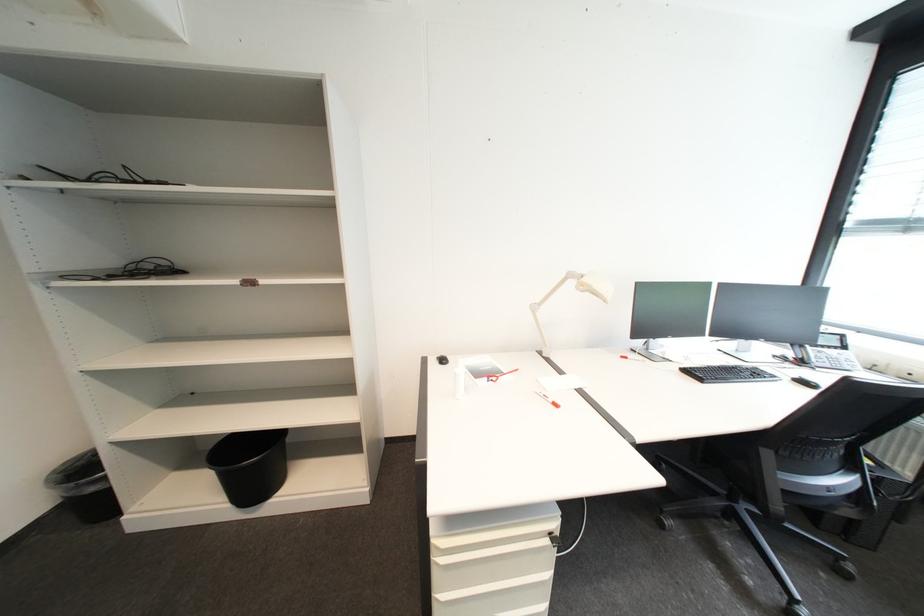
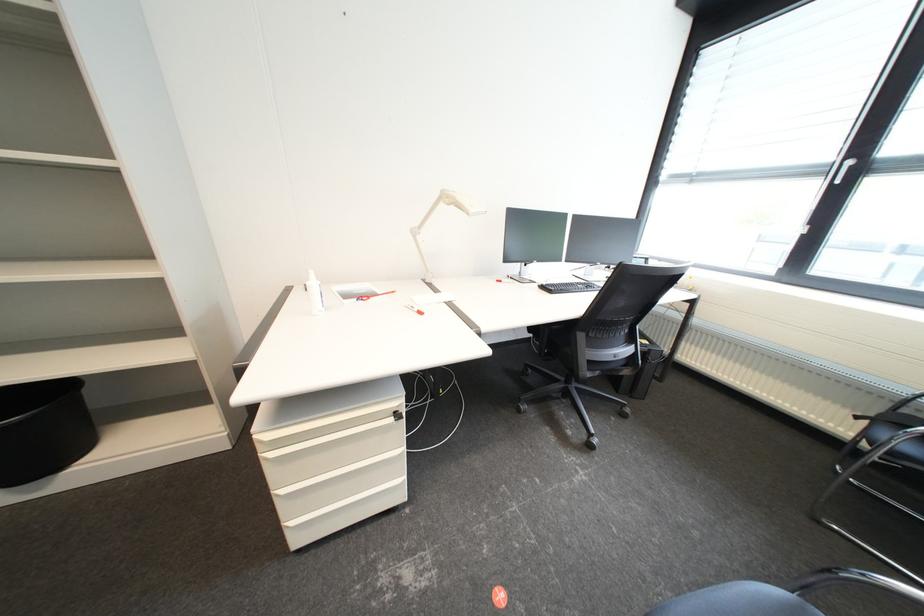
Question: Which direction would the cameraman need to move to produce the second image? Reply with the corresponding letter.

Choices:
 (A) Left
 (B) Right
 (C) Forward
 (D) Backward

Answer: (B)